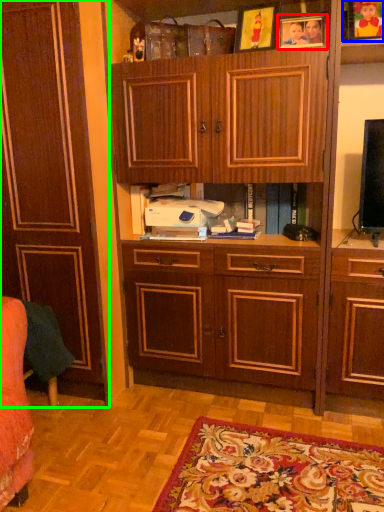
Question: Estimate the real-world distances between objects in this image. Which object is closer to picture frame (highlighted by a red box), picture frame (highlighted by a blue box) or cabinetry (highlighted by a green box)?

Choices:
 (A) picture frame
 (B) cabinetry

Answer: (A)